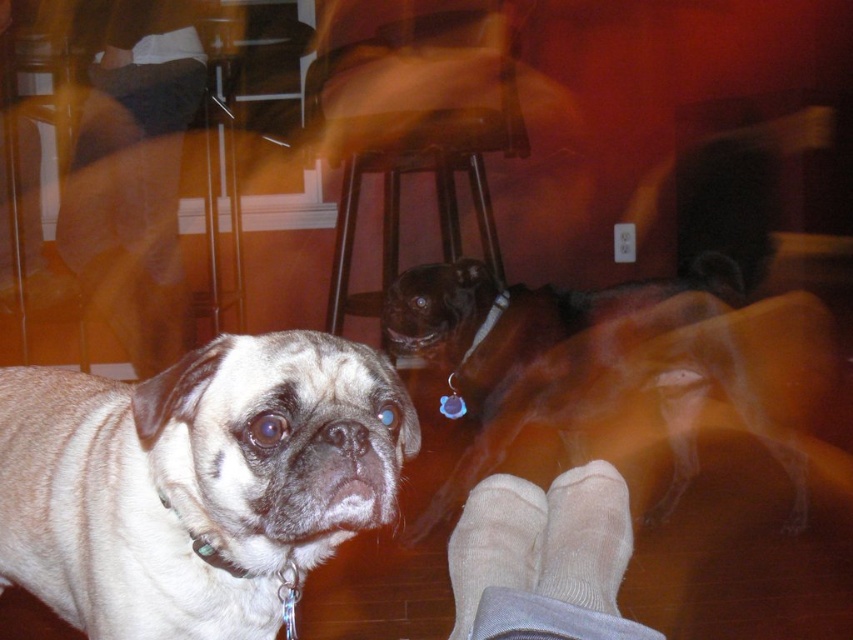
You are trying to decide whether to place a new decorative item between the beige cotton socks at lower right and the brown wooden stool at center. Which object should you place the item closer to if you want it to be near the thinner object?

The beige cotton socks at lower right is thinner than the brown wooden stool at center, so you should place the item closer to the beige cotton socks at lower right.